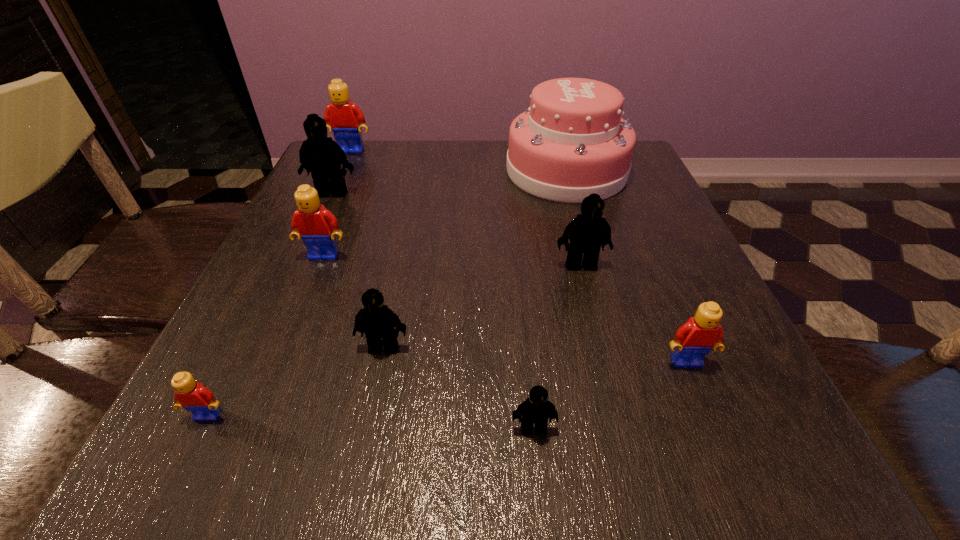
Locate which yellow Lego ranks fourth in proximity to the second Lego from right to left. Please provide its 2D coordinates. Your answer should be formatted as a tuple, i.e. [(x, y)], where the tuple contains the x and y coordinates of a point satisfying the conditions above.

[(344, 118)]